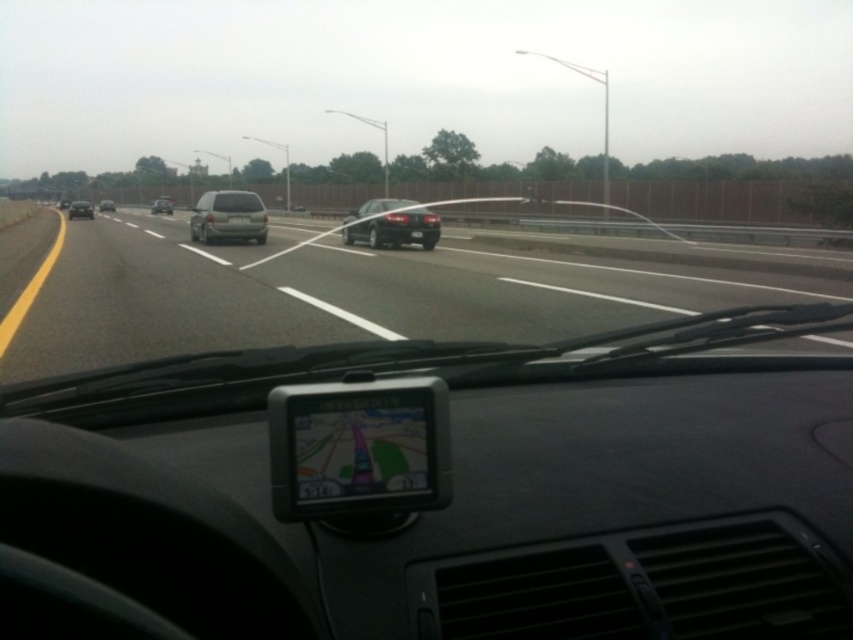
Question: Which point is closer to the camera?

Choices:
 (A) silver metallic suv at center
 (B) shiny black sedan at center
 (C) satin silver suv at center
 (D) matte gray car at center

Answer: (B)

Question: Which point appears farthest from the camera in this image?

Choices:
 (A) (73, 250)
 (B) (241, 189)

Answer: (B)

Question: Among these objects, which one is nearest to the camera?

Choices:
 (A) silver metallic sedan at center
 (B) matte gray car at center
 (C) satin silver minivan at center

Answer: (B)

Question: Is shiny black sedan at center thinner than silver metallic sedan at center?

Choices:
 (A) no
 (B) yes

Answer: (B)

Question: Is matte gray car at center thinner than silver metallic sedan at center?

Choices:
 (A) yes
 (B) no

Answer: (A)

Question: Does asphalt road at center have a smaller size compared to silver metallic suv at center?

Choices:
 (A) yes
 (B) no

Answer: (A)